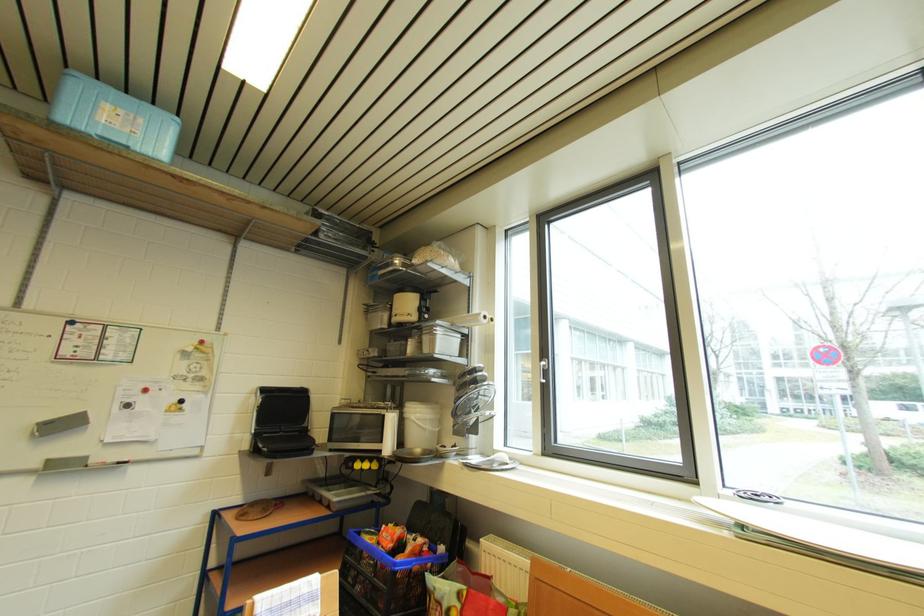
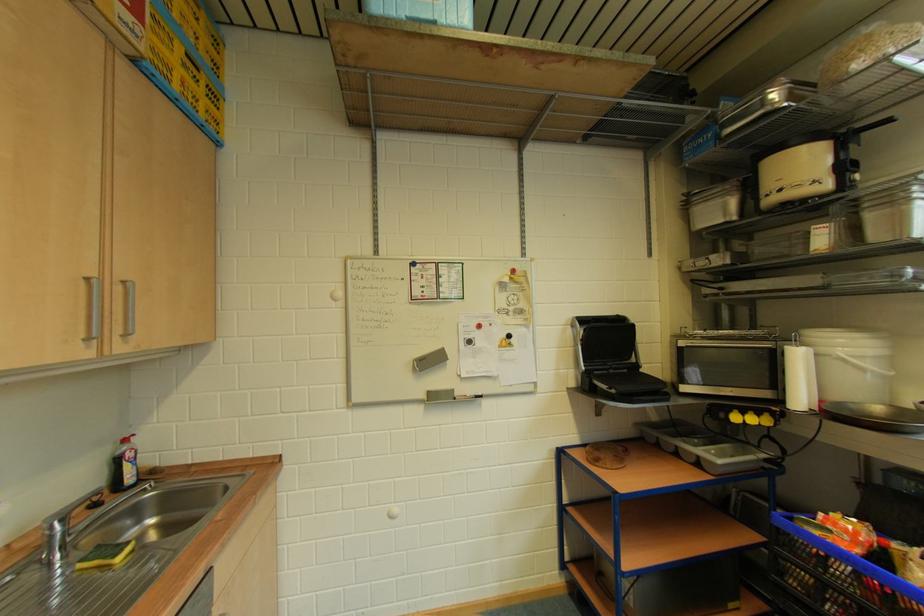
Locate, in the second image, the point that corresponds to (426,454) in the first image.

(884, 411)